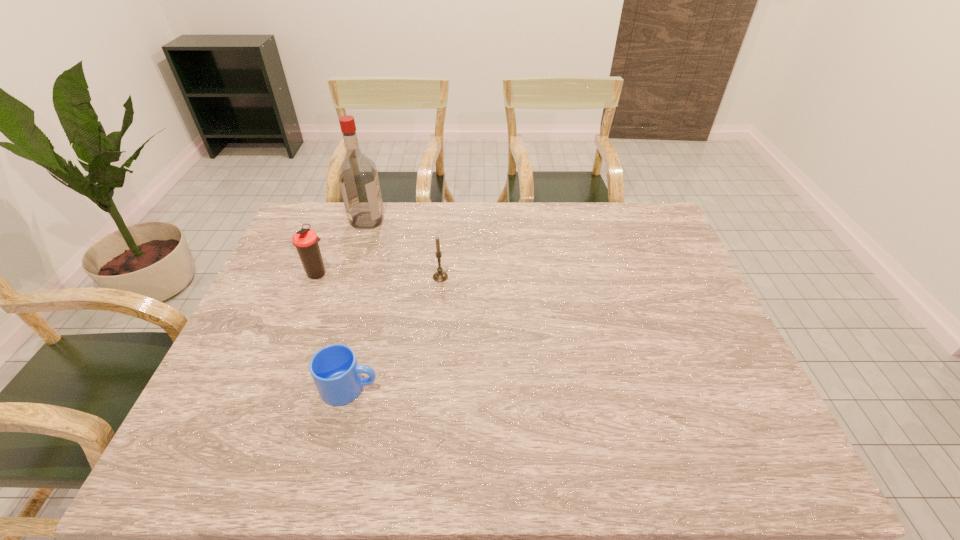
Where is `free region that satisfies the following two spatial constraints: 1. on the back side of the candle; 2. on the front-facing side of the liquor`? free region that satisfies the following two spatial constraints: 1. on the back side of the candle; 2. on the front-facing side of the liquor is located at coordinates (445, 220).

Find the location of a particular element. The height and width of the screenshot is (540, 960). free location that satisfies the following two spatial constraints: 1. on the back side of the rightmost object; 2. on the front-facing side of the farthest object is located at coordinates (445, 220).

At what (x,y) coordinates should I click in order to perform the action: click on free location that satisfies the following two spatial constraints: 1. on the front-facing side of the farthest object; 2. on the left side of the rightmost object. Please return your answer as a coordinate pair (x, y). Image resolution: width=960 pixels, height=540 pixels. Looking at the image, I should click on (349, 277).